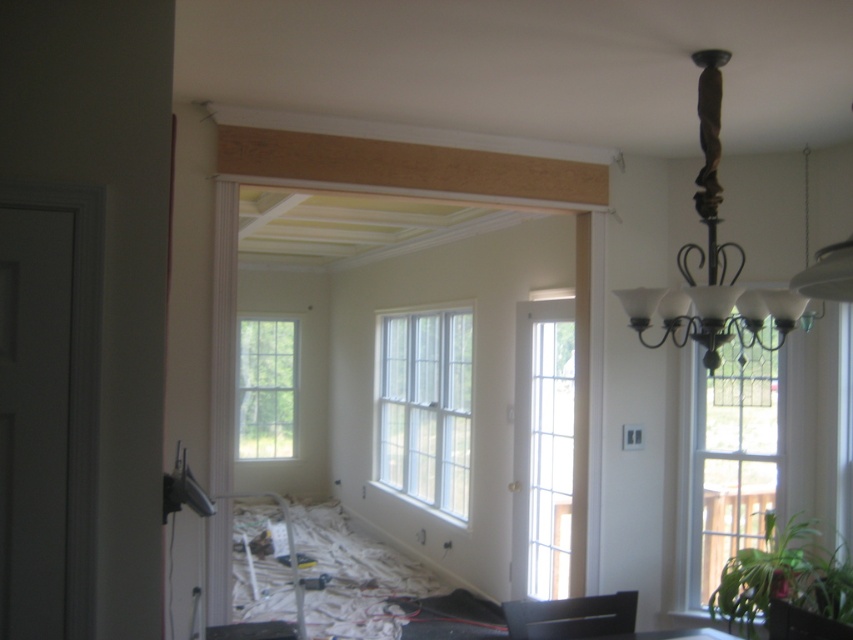
You are an interior designer assessing the room layout. You notice the clear glass window at right and the white glass window at center. Which window is taller?

The white glass window at center is taller than the clear glass window at right.